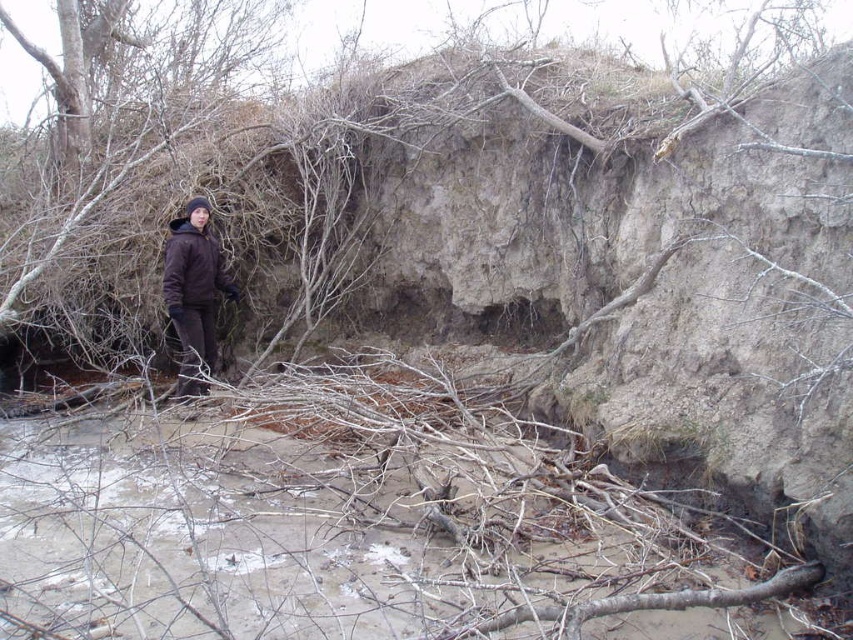
Measure the distance between brown soft jacket at left and camera.

brown soft jacket at left is 5.87 meters from camera.

Does brown soft jacket at left appear on the right side of brown matte jacket at left?

In fact, brown soft jacket at left is to the left of brown matte jacket at left.

Which is in front, point (187, 257) or point (190, 225)?

Point (187, 257)

Locate an element on the screen. Image resolution: width=853 pixels, height=640 pixels. brown soft jacket at left is located at coordinates (193, 291).